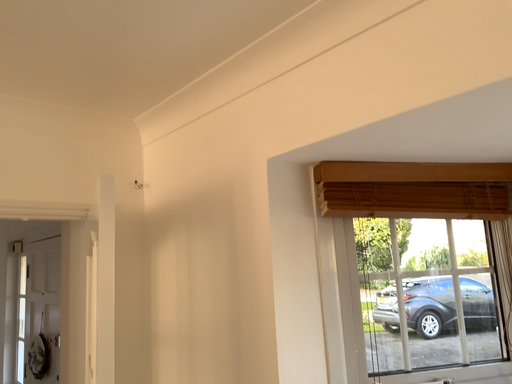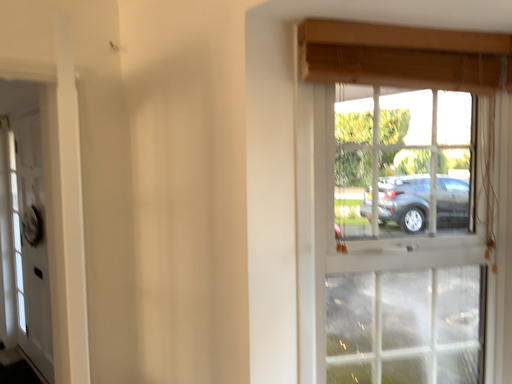
Question: How did the camera likely rotate when shooting the video?

Choices:
 (A) rotated upward
 (B) rotated downward

Answer: (B)